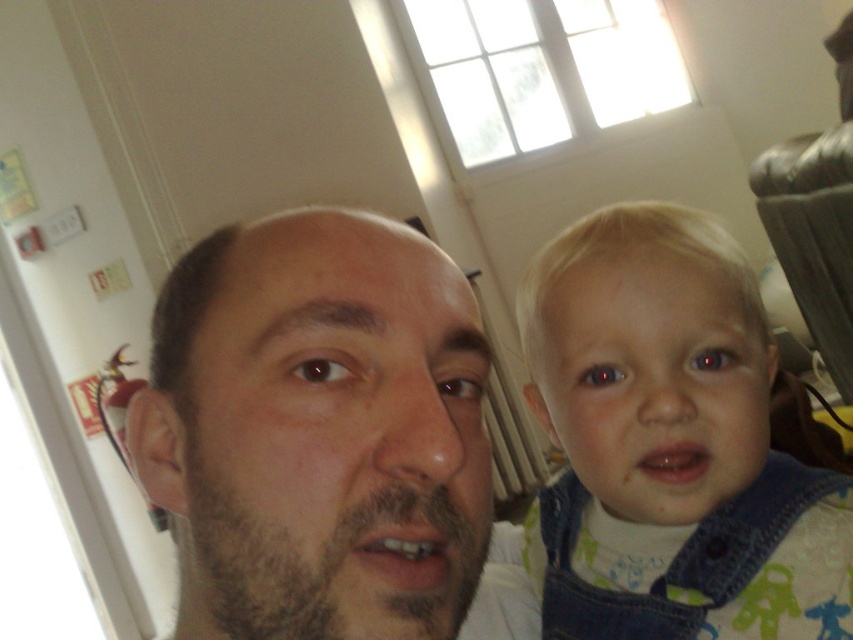
Who is more distant from viewer, (415, 506) or (660, 204)?

Positioned behind is point (660, 204).

Is smooth skin face at center bigger than denim overalls at right?

Incorrect, smooth skin face at center is not larger than denim overalls at right.

What do you see at coordinates (318, 432) in the screenshot?
I see `smooth skin face at center` at bounding box center [318, 432].

At what (x,y) coordinates should I click in order to perform the action: click on smooth skin face at center. Please return your answer as a coordinate pair (x, y). The image size is (853, 640). Looking at the image, I should click on (318, 432).